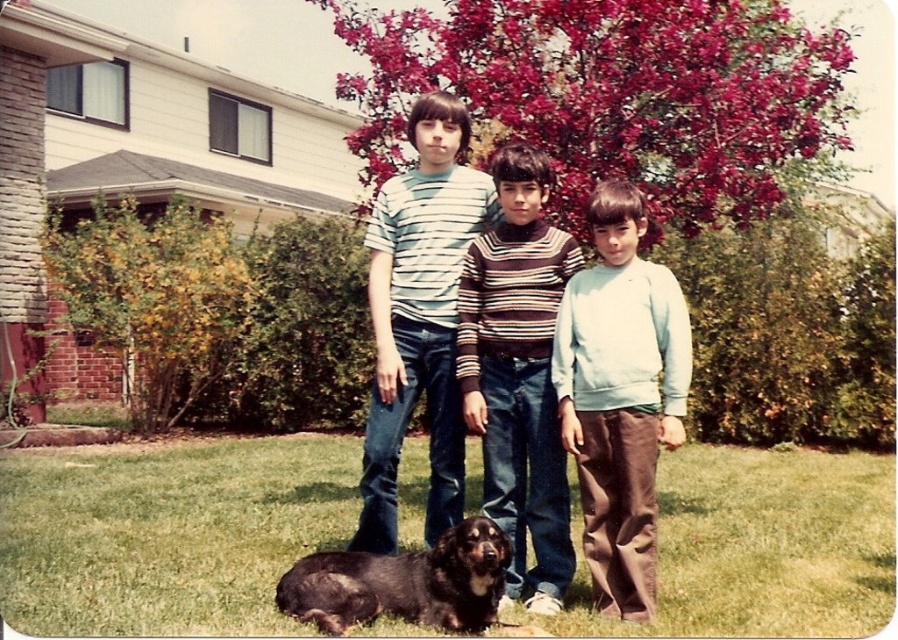
You are standing at the origin point in the image, which is the bottom left corner. You want to locate the light blue sweater at center. Which direction should you move to reach it?

To reach the light blue sweater at center, you should move towards the northeast direction since its coordinates are at point 0.619 on the x axis and 0.692 on the y axis, which is northeast from the origin.